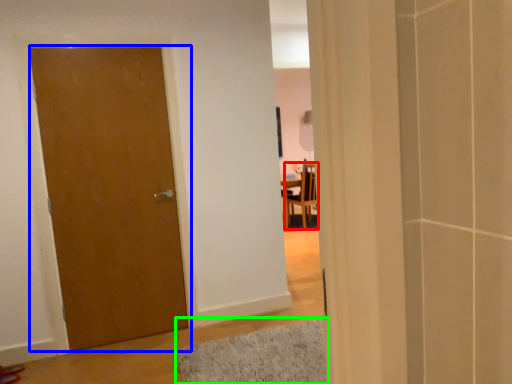
Question: Based on their relative distances, which object is nearer to chair (highlighted by a red box)? Choose from door (highlighted by a blue box) and bath mat (highlighted by a green box).

Choices:
 (A) door
 (B) bath mat

Answer: (B)